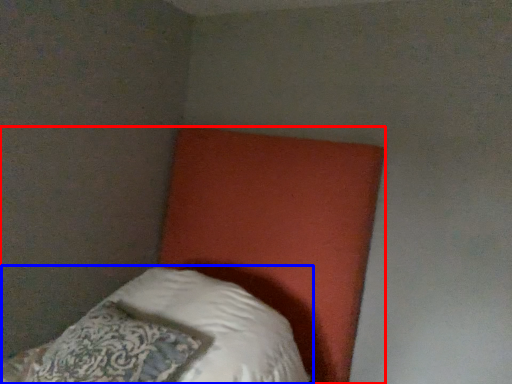
Question: Which of the following is the farthest to the observer, bed (highlighted by a red box) or pillow (highlighted by a blue box)?

Choices:
 (A) bed
 (B) pillow

Answer: (B)